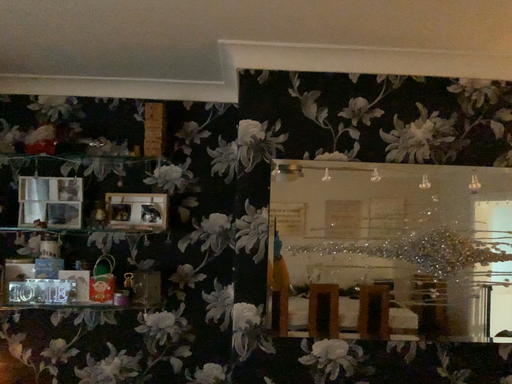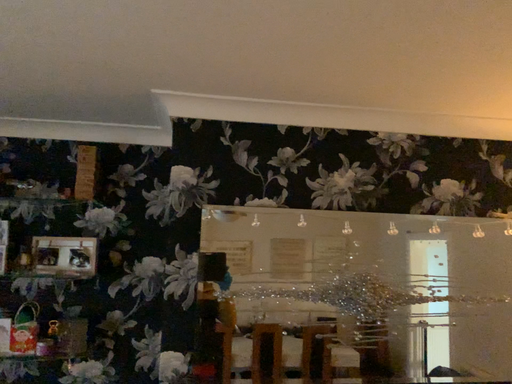
Question: Which way did the camera rotate in the video?

Choices:
 (A) rotated right
 (B) rotated left

Answer: (A)